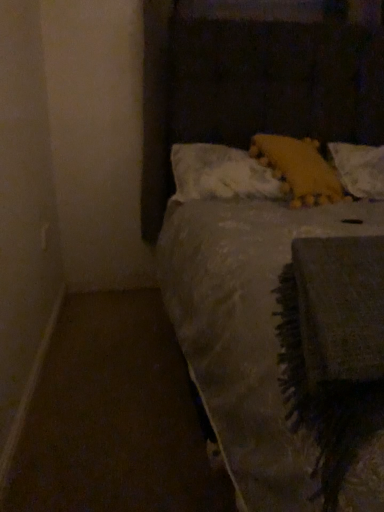
Question: Is white fluffy pillow at upper center, the third pillow in the right-to-left sequence, wider than yellow fuzzy pillow at upper right, acting as the 2th pillow starting from the left?

Choices:
 (A) yes
 (B) no

Answer: (B)

Question: From a real-world perspective, is white fluffy pillow at upper center, which is the first pillow in left-to-right order, physically above yellow fuzzy pillow at upper right, which appears as the second pillow when viewed from the right?

Choices:
 (A) yes
 (B) no

Answer: (B)

Question: Does white fluffy pillow at upper center, the third pillow in the right-to-left sequence, turn towards yellow fuzzy pillow at upper right, acting as the 2th pillow starting from the left?

Choices:
 (A) yes
 (B) no

Answer: (A)

Question: Is the position of white fluffy pillow at upper center, the third pillow in the right-to-left sequence, more distant than that of yellow fuzzy pillow at upper right, acting as the 2th pillow starting from the left?

Choices:
 (A) yes
 (B) no

Answer: (A)

Question: Does white fluffy pillow at upper center, the third pillow in the right-to-left sequence, touch yellow fuzzy pillow at upper right, which appears as the second pillow when viewed from the right?

Choices:
 (A) no
 (B) yes

Answer: (A)

Question: Is there a large distance between white fluffy pillow at upper center, the third pillow in the right-to-left sequence, and yellow fuzzy pillow at upper right, which appears as the second pillow when viewed from the right?

Choices:
 (A) yes
 (B) no

Answer: (B)

Question: From a real-world perspective, is white fluffy pillow at upper center, the third pillow in the right-to-left sequence, below yellow fabric pillow at upper right, marked as the 1th pillow in a right-to-left arrangement?

Choices:
 (A) yes
 (B) no

Answer: (B)

Question: Considering the relative sizes of white fluffy pillow at upper center, the third pillow in the right-to-left sequence, and yellow fabric pillow at upper right, marked as the 1th pillow in a right-to-left arrangement, in the image provided, is white fluffy pillow at upper center, the third pillow in the right-to-left sequence, taller than yellow fabric pillow at upper right, marked as the 1th pillow in a right-to-left arrangement,?

Choices:
 (A) no
 (B) yes

Answer: (A)

Question: Is white fluffy pillow at upper center, the third pillow in the right-to-left sequence, shorter than yellow fabric pillow at upper right, the third pillow viewed from the left?

Choices:
 (A) no
 (B) yes

Answer: (B)

Question: Is white fluffy pillow at upper center, which is the first pillow in left-to-right order, further to the viewer compared to yellow fabric pillow at upper right, the third pillow viewed from the left?

Choices:
 (A) yes
 (B) no

Answer: (B)

Question: Can you confirm if white fluffy pillow at upper center, the third pillow in the right-to-left sequence, is wider than yellow fabric pillow at upper right, marked as the 1th pillow in a right-to-left arrangement?

Choices:
 (A) no
 (B) yes

Answer: (A)

Question: Is white fluffy pillow at upper center, the third pillow in the right-to-left sequence, thinner than yellow fabric pillow at upper right, marked as the 1th pillow in a right-to-left arrangement?

Choices:
 (A) yes
 (B) no

Answer: (A)

Question: Can you confirm if yellow fuzzy pillow at upper right, which appears as the second pillow when viewed from the right, is taller than white fluffy pillow at upper center, which is the first pillow in left-to-right order?

Choices:
 (A) yes
 (B) no

Answer: (A)